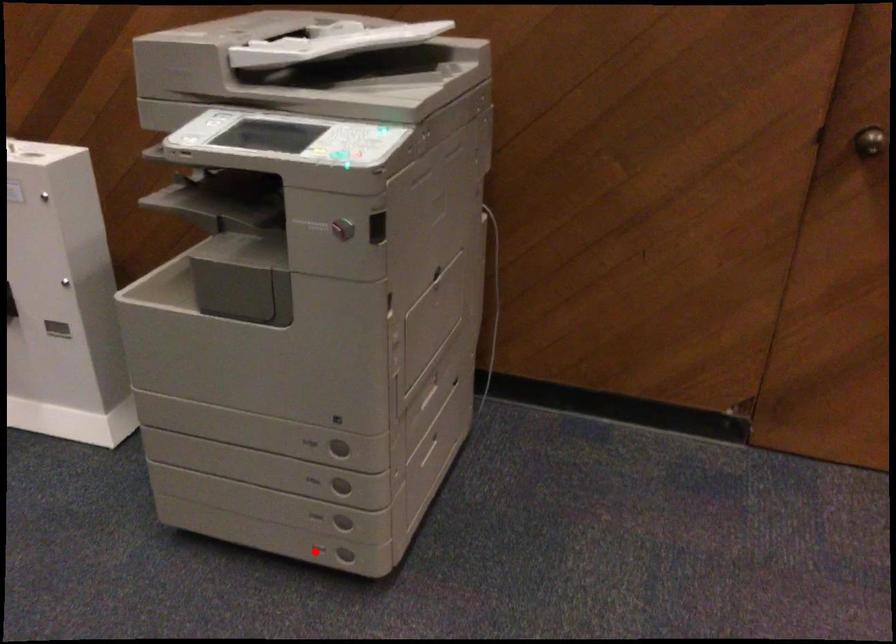
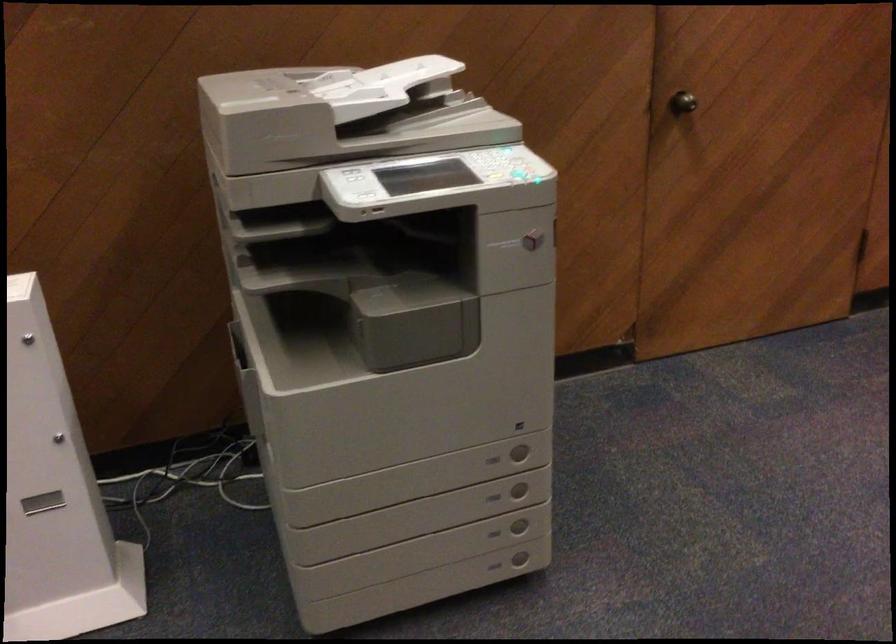
In the second image, find the point that corresponds to the highlighted location in the first image.

(494, 567)